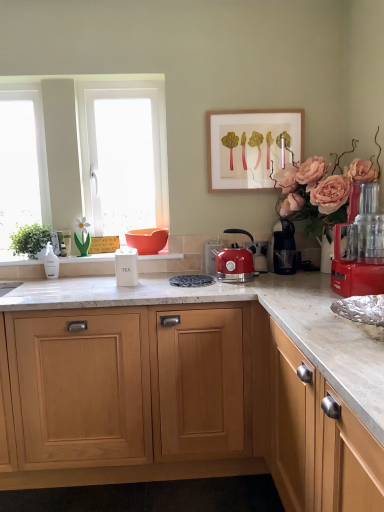
Where is `empty space that is ontop of white glass window at left (from a real-world perspective)`? empty space that is ontop of white glass window at left (from a real-world perspective) is located at coordinates (14, 85).